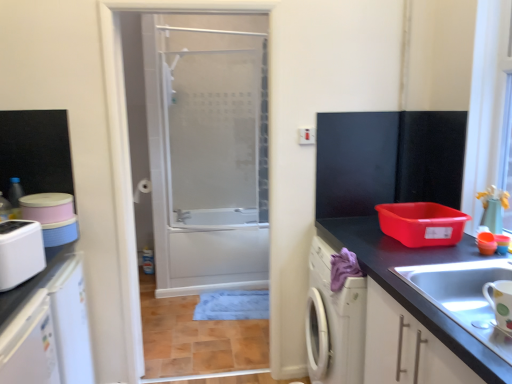
Question: From the image's perspective, is transparent glass door at center located above white matte cabinet at lower right?

Choices:
 (A) yes
 (B) no

Answer: (A)

Question: Does transparent glass door at center appear on the left side of white matte cabinet at lower right?

Choices:
 (A) no
 (B) yes

Answer: (B)

Question: From the image's perspective, does transparent glass door at center appear lower than white matte cabinet at lower right?

Choices:
 (A) no
 (B) yes

Answer: (A)

Question: From a real-world perspective, is transparent glass door at center under white matte cabinet at lower right?

Choices:
 (A) no
 (B) yes

Answer: (A)

Question: Is transparent glass door at center facing away from white matte cabinet at lower right?

Choices:
 (A) yes
 (B) no

Answer: (B)

Question: Considering their positions, is matte silver faucet at upper center located in front of or behind white plastic toaster at left, arranged as the 1th appliance when viewed from the back?

Choices:
 (A) front
 (B) behind

Answer: (B)

Question: Looking at their shapes, would you say matte silver faucet at upper center is wider or thinner than white plastic toaster at left, arranged as the second appliance when viewed from the front?

Choices:
 (A) thin
 (B) wide

Answer: (B)

Question: Considering the positions of matte silver faucet at upper center and white plastic toaster at left, arranged as the 1th appliance when viewed from the back, in the image, is matte silver faucet at upper center bigger or smaller than white plastic toaster at left, arranged as the 1th appliance when viewed from the back,?

Choices:
 (A) big
 (B) small

Answer: (B)

Question: Visually, is matte silver faucet at upper center positioned to the left or to the right of white plastic toaster at left, arranged as the 1th appliance when viewed from the back?

Choices:
 (A) left
 (B) right

Answer: (B)

Question: In terms of size, does white glossy mug at lower right, marked as the 2th appliance in a back-to-front arrangement, appear bigger or smaller than white plastic toaster at left, arranged as the second appliance when viewed from the front?

Choices:
 (A) big
 (B) small

Answer: (B)

Question: Does point (497, 296) appear closer or farther from the camera than point (14, 233)?

Choices:
 (A) closer
 (B) farther

Answer: (A)

Question: Is white glossy mug at lower right, the 2th appliance positioned from the left, wider or thinner than white plastic toaster at left, arranged as the 1th appliance when viewed from the back?

Choices:
 (A) wide
 (B) thin

Answer: (B)

Question: In the image, is white glossy mug at lower right, which ranks as the 1th appliance in front-to-back order, on the left side or the right side of white plastic toaster at left, acting as the first appliance starting from the left?

Choices:
 (A) left
 (B) right

Answer: (B)

Question: Would you say transparent glass door at center is to the left or to the right of white plastic toaster at left, positioned as the 2th appliance in right-to-left order, in the picture?

Choices:
 (A) left
 (B) right

Answer: (B)

Question: From the image's perspective, is transparent glass door at center above or below white plastic toaster at left, arranged as the second appliance when viewed from the front?

Choices:
 (A) above
 (B) below

Answer: (A)